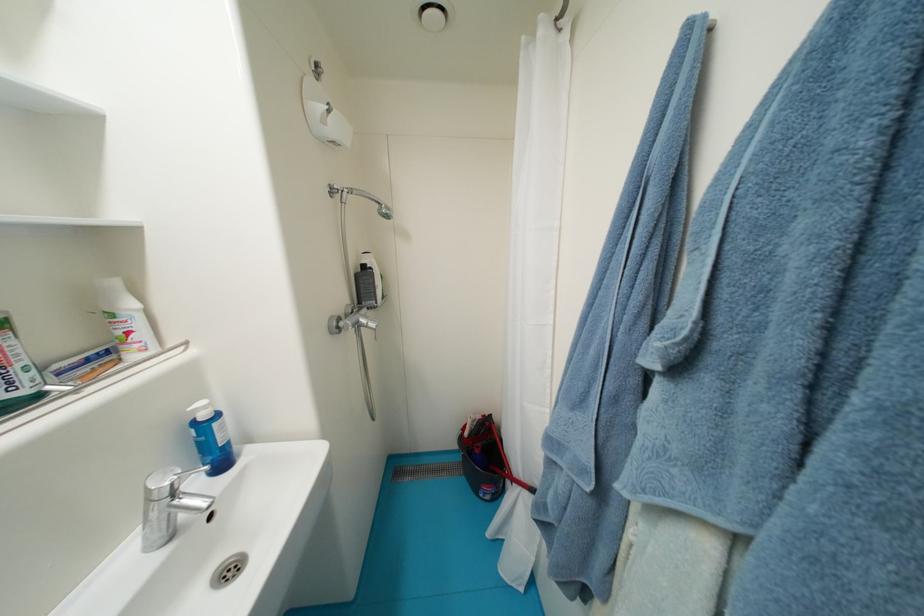
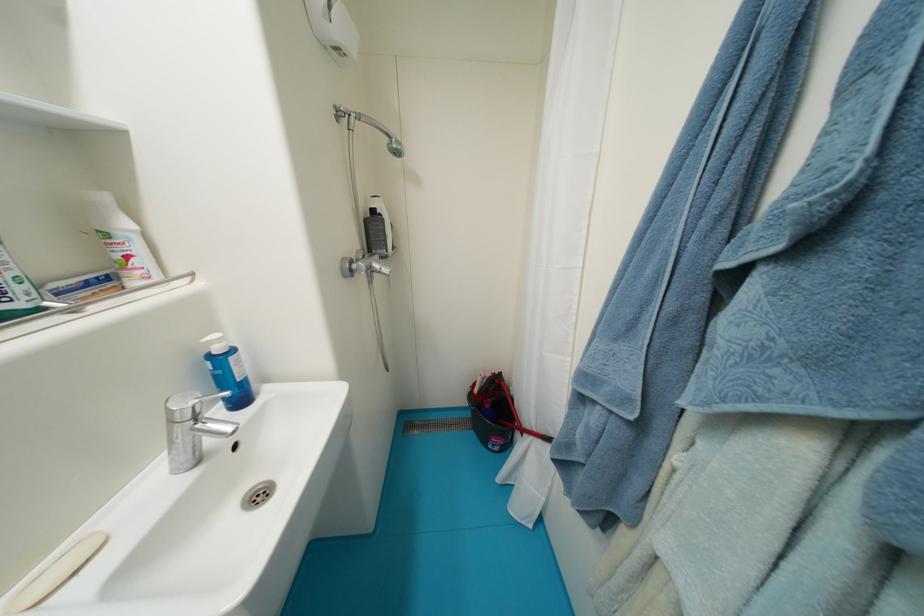
In the second image, find the point that corresponds to (136,334) in the first image.

(134, 259)